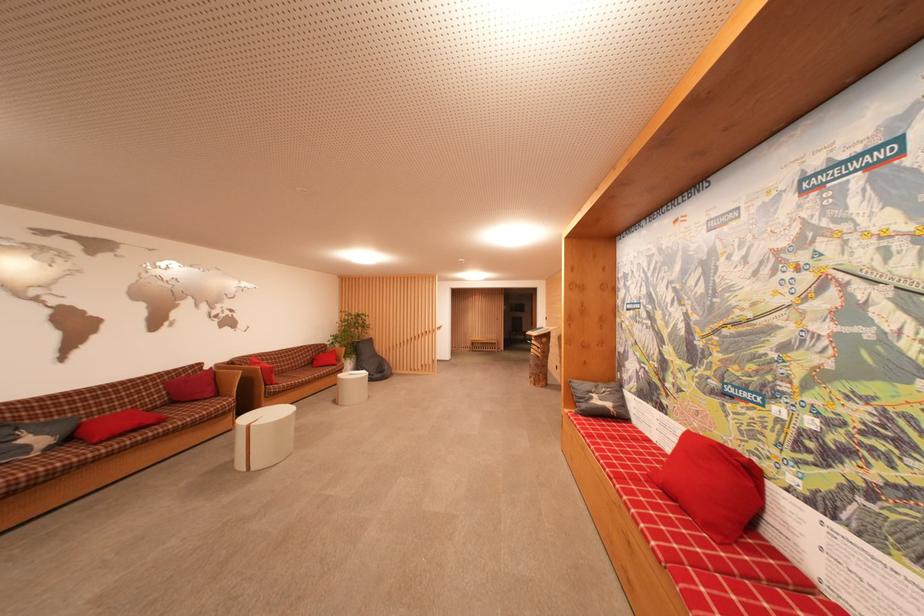
Find where to lean the sofa armrest. Please return your answer as a coordinate pair (x, y).

(246, 374)